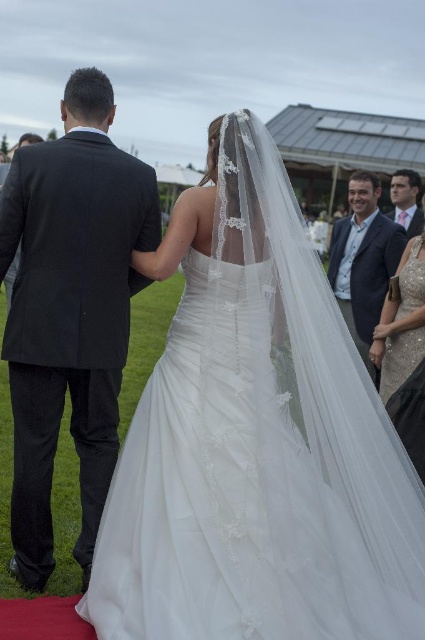
Question: Is dark blue suit at right above satin gold dress at right?

Choices:
 (A) no
 (B) yes

Answer: (B)

Question: Can you confirm if dark blue suit at right is positioned above satin gold dress at right?

Choices:
 (A) yes
 (B) no

Answer: (A)

Question: Estimate the real-world distances between objects in this image. Which object is farther from the dark blue suit at right?

Choices:
 (A) satin gold dress at right
 (B) white tulle dress at center

Answer: (B)

Question: Which point is farther from the camera taking this photo?

Choices:
 (A) (346, 636)
 (B) (345, 257)

Answer: (B)

Question: Does white tulle dress at center appear over satin gold dress at right?

Choices:
 (A) no
 (B) yes

Answer: (B)

Question: Estimate the real-world distances between objects in this image. Which object is closer to the matte pink shirt at upper right?

Choices:
 (A) white tulle dress at center
 (B) dark blue suit at right
 (C) dark gray suit at left

Answer: (B)